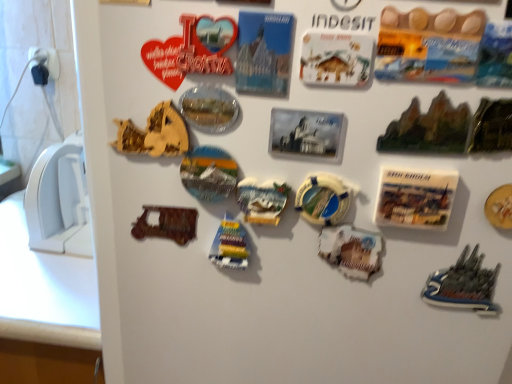
Question: Considering the relative sizes of yellow lifebuoy at center, which is counted as the 4th stuff, starting from the left, and wooden toy boat at center, marked as the 6th stuff in a right-to-left arrangement, in the image provided, is yellow lifebuoy at center, which is counted as the 4th stuff, starting from the left, shorter than wooden toy boat at center, marked as the 6th stuff in a right-to-left arrangement,?

Choices:
 (A) no
 (B) yes

Answer: (B)

Question: From the image's perspective, is yellow lifebuoy at center, the fourth stuff positioned from the right, below wooden toy boat at center, marked as the 6th stuff in a right-to-left arrangement?

Choices:
 (A) yes
 (B) no

Answer: (B)

Question: Is yellow lifebuoy at center, the fourth stuff positioned from the right, bigger than wooden toy boat at center, marked as the 6th stuff in a right-to-left arrangement?

Choices:
 (A) yes
 (B) no

Answer: (B)

Question: Is yellow lifebuoy at center, which is counted as the 4th stuff, starting from the left, closer to camera compared to wooden toy boat at center, marked as the 6th stuff in a right-to-left arrangement?

Choices:
 (A) yes
 (B) no

Answer: (A)

Question: Considering the relative sizes of yellow lifebuoy at center, which is counted as the 4th stuff, starting from the left, and wooden toy boat at center, marked as the 6th stuff in a right-to-left arrangement, in the image provided, is yellow lifebuoy at center, which is counted as the 4th stuff, starting from the left, taller than wooden toy boat at center, marked as the 6th stuff in a right-to-left arrangement,?

Choices:
 (A) no
 (B) yes

Answer: (A)

Question: Considering the relative sizes of yellow lifebuoy at center, the fourth stuff positioned from the right, and wooden toy boat at center, marked as the 6th stuff in a right-to-left arrangement, in the image provided, is yellow lifebuoy at center, the fourth stuff positioned from the right, smaller than wooden toy boat at center, marked as the 6th stuff in a right-to-left arrangement,?

Choices:
 (A) no
 (B) yes

Answer: (B)

Question: Is green glossy rock formation at upper right, which is the 2th stuff in right-to-left order, facing towards dark gray plastic ship at lower right?

Choices:
 (A) no
 (B) yes

Answer: (A)

Question: From the image's perspective, would you say green glossy rock formation at upper right, which is the 2th stuff in right-to-left order, is shown under dark gray plastic ship at lower right?

Choices:
 (A) yes
 (B) no

Answer: (B)

Question: Would you say dark gray plastic ship at lower right is part of green glossy rock formation at upper right, the 6th stuff viewed from the left,'s contents?

Choices:
 (A) no
 (B) yes

Answer: (A)

Question: From the image's perspective, is green glossy rock formation at upper right, which is the 2th stuff in right-to-left order, located above dark gray plastic ship at lower right?

Choices:
 (A) no
 (B) yes

Answer: (B)

Question: Would you say green glossy rock formation at upper right, the 6th stuff viewed from the left, is outside dark gray plastic ship at lower right?

Choices:
 (A) no
 (B) yes

Answer: (B)

Question: Are green glossy rock formation at upper right, which is the 2th stuff in right-to-left order, and dark gray plastic ship at lower right making contact?

Choices:
 (A) no
 (B) yes

Answer: (A)

Question: Does wooden toy boat at center, marked as the 6th stuff in a right-to-left arrangement, have a larger size compared to wooden puzzle piece at upper left, acting as the 1th stuff starting from the left?

Choices:
 (A) no
 (B) yes

Answer: (B)